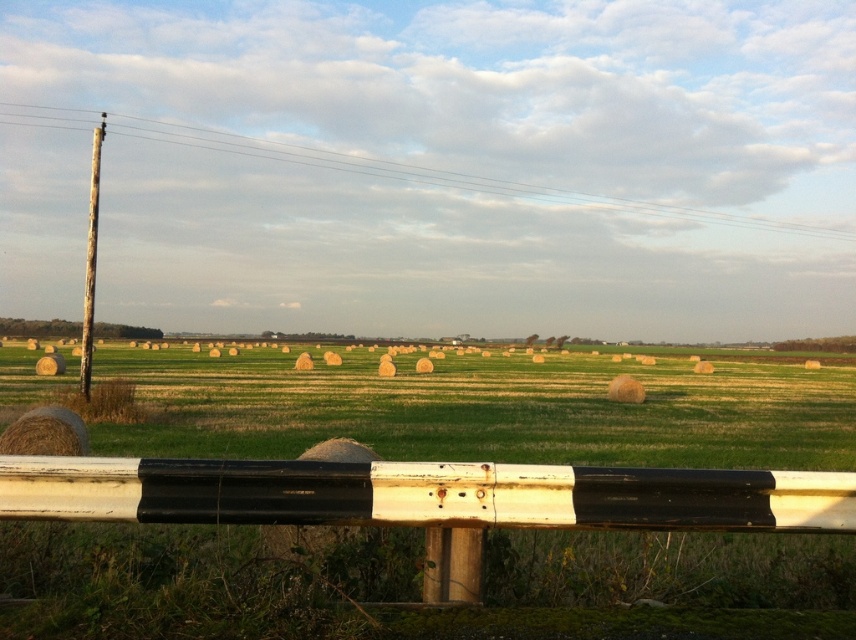
You are a farmer planning to transport the yellow straw bales at center and the weathered wood pole at left using a truck with a 5 meter long bed. Considering their sizes, will both items fit side by side in the truck bed?

The yellow straw bales at center has a smaller size compared to weathered wood pole at left, but without specific measurements of their individual lengths, it is impossible to determine if they can fit side by side in the 5 meter long truck bed.

You are a farmer who needs to move a 30 meter long fence from the weathered wood pole at left to the yellow straw bales at center. Can you fit the entire fence between them without bending it?

The distance between the yellow straw bales at center and the weathered wood pole at left is 26.57 meters, which is shorter than the 30 meter fence. Therefore, the entire fence cannot be placed between them without bending it.

You are standing at the point marked by the coordinates point [483,410], which indicates yellow straw bales at center. You want to walk towards the guardrail at the edge of the field. Is the guardrail in front of or behind you?

The guardrail is behind you because the point [483,410] indicates yellow straw bales at center, and the guardrail is at the edge of the field, so moving towards it would mean the guardrail is in front of you. Wait, this seems contradictory. Let me reevaluate. The scene description says the guardrail is at the edge of the grassy field where hay bales are scattered. The point given is at the center with yellow straw bales. If you are at the center, the guardrail being at the edge would be in front if you